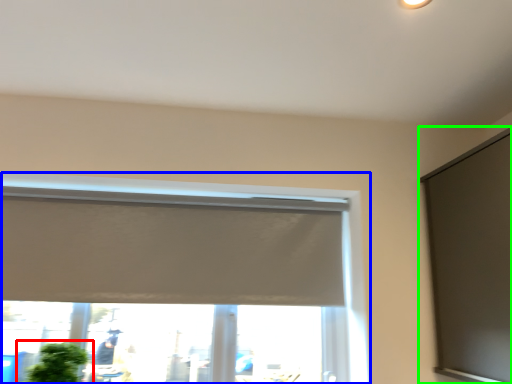
Question: Which object is positioned farthest from houseplant (highlighted by a red box)? Select from window (highlighted by a blue box) and window screen (highlighted by a green box).

Choices:
 (A) window
 (B) window screen

Answer: (B)